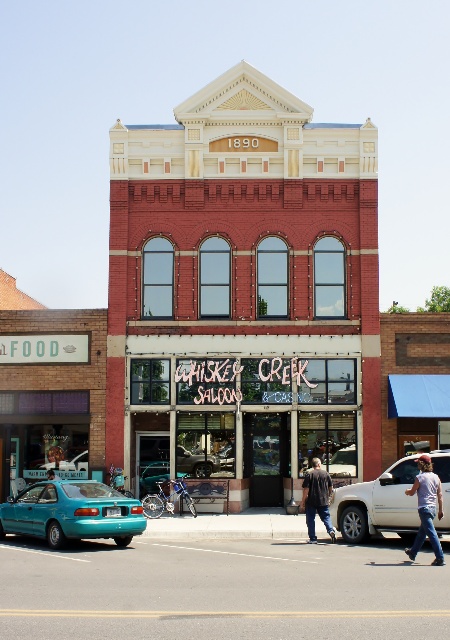
Based on the photo, is the position of teal matte car at lower left more distant than that of brown textured jacket at center?

That is False.

Does teal matte car at lower left have a greater height compared to brown textured jacket at center?

In fact, teal matte car at lower left may be shorter than brown textured jacket at center.

Which is in front, point (27, 509) or point (329, 524)?

Point (329, 524) is more forward.

Where is `teal matte car at lower left`? The width and height of the screenshot is (450, 640). teal matte car at lower left is located at coordinates (72, 513).

Who is lower down, white matte truck at center or denim jeans at lower right?

Positioned lower is white matte truck at center.

Which is in front, point (440, 451) or point (432, 477)?

Point (432, 477)

Image resolution: width=450 pixels, height=640 pixels. I want to click on white matte truck at center, so click(x=378, y=504).

Is teal matte car at lower left above denim jeans at lower right?

No, teal matte car at lower left is not above denim jeans at lower right.

Between point (53, 520) and point (431, 515), which one is positioned in front?

Positioned in front is point (431, 515).

Where is `teal matte car at lower left`? The width and height of the screenshot is (450, 640). teal matte car at lower left is located at coordinates (72, 513).